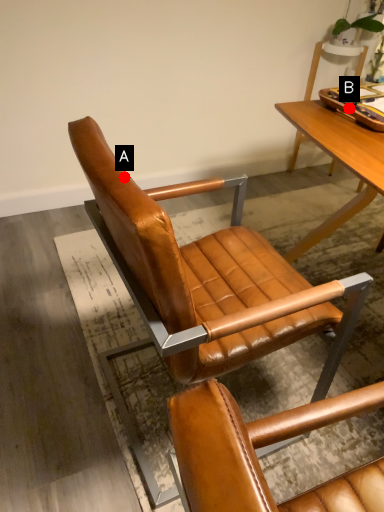
Question: Two points are circled on the image, labeled by A and B beside each circle. Which point is farther from the camera taking this photo?

Choices:
 (A) A is further
 (B) B is further

Answer: (B)